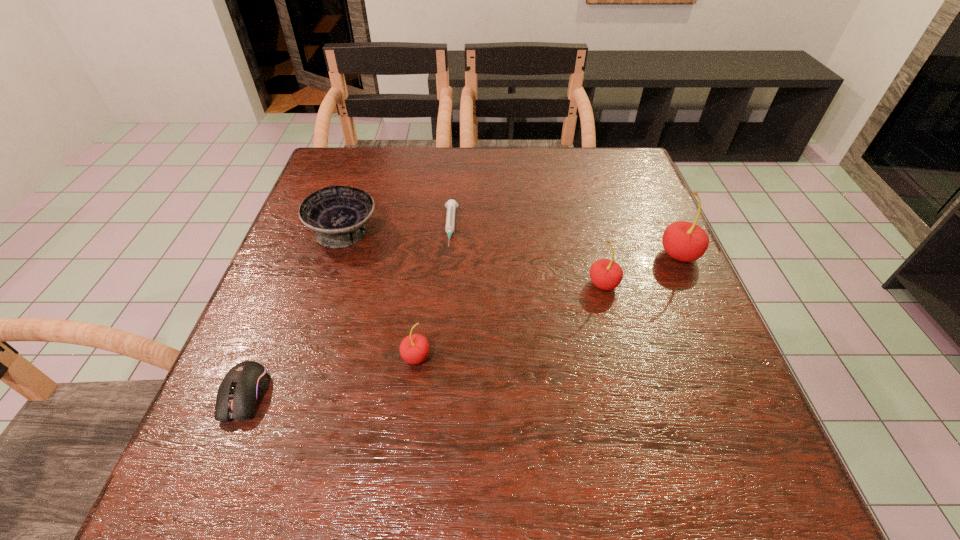
This screenshot has height=540, width=960. Find the location of `vacant space that satisfies the following two spatial constraints: 1. on the back side of the rightmost cherry; 2. on the left side of the leftmost cherry`. vacant space that satisfies the following two spatial constraints: 1. on the back side of the rightmost cherry; 2. on the left side of the leftmost cherry is located at coordinates (428, 255).

Identify the location of free space that satisfies the following two spatial constraints: 1. on the back side of the second tallest cherry; 2. on the right side of the leftmost cherry. The image size is (960, 540). [424, 284].